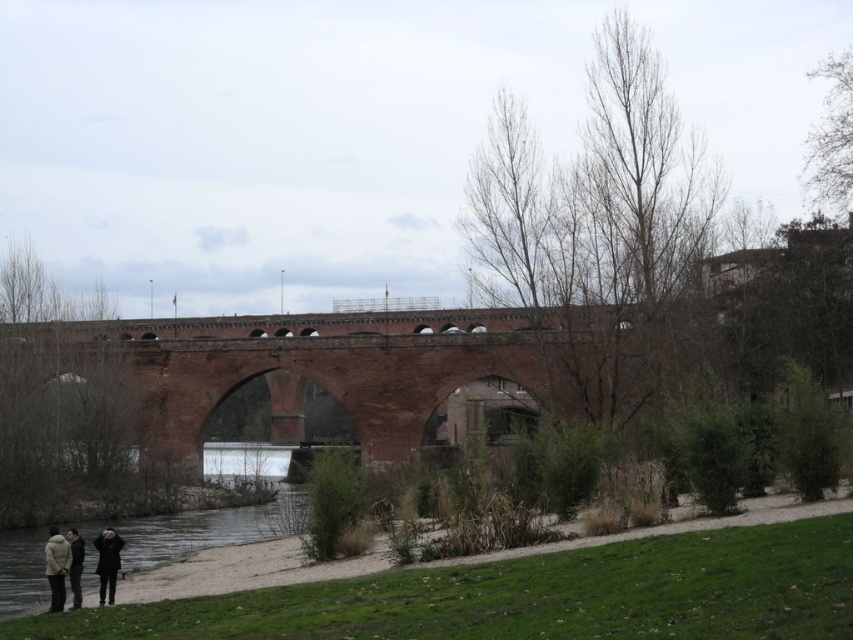
You are a photographer planning to take a wide shot of the red brick bridge at center and the dark gray coat at lower left. Given that your camera can only capture objects within a 5 meter width, will both objects fit in the frame?

The red brick bridge at center is wider than the dark gray coat at lower left. Since the camera can capture up to 5 meters, but the bridge itself is wider than the coat, it depends on the actual widths. However, the description only states the bridge is wider, not by how much. Without specific measurements, we cannot confirm if both fit within the 5 meter limit.

You are a photographer trying to capture the three people standing on the path near the historic brick bridge. You notice the beige wool coat at lower left and the dark gray sweater at lower left. Which clothing item is taller when viewed from your position?

The beige wool coat at lower left is taller than the dark gray sweater at lower left.